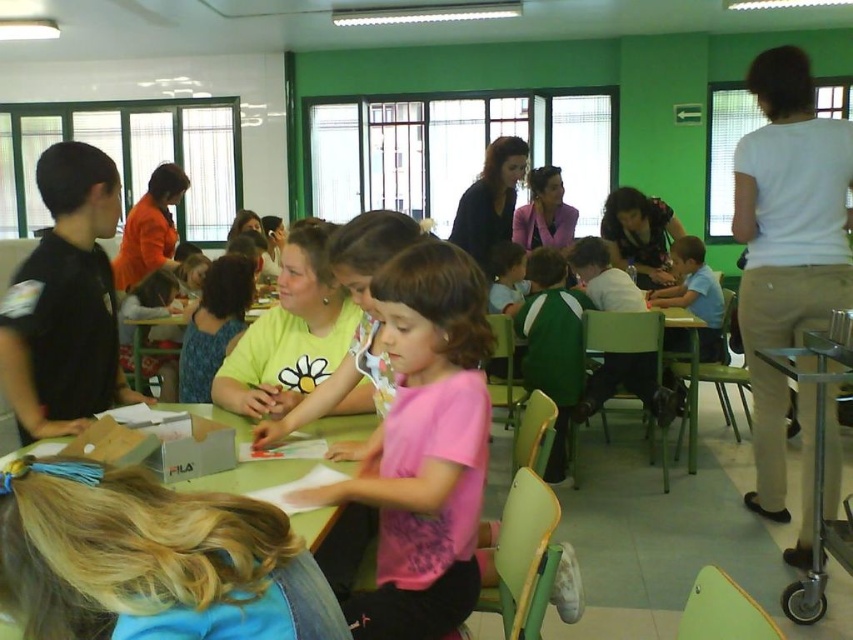
Question: Is pink matte shirt at center thinner than green plastic table at center?

Choices:
 (A) yes
 (B) no

Answer: (A)

Question: Which object is closer to the camera taking this photo?

Choices:
 (A) white cotton shirt at right
 (B) green plastic table at center

Answer: (B)

Question: Estimate the real-world distances between objects in this image. Which object is farther from the green plastic table at center?

Choices:
 (A) white cotton shirt at right
 (B) pink matte shirt at center

Answer: (A)

Question: Which object is positioned farthest from the white cotton shirt at right?

Choices:
 (A) green plastic table at center
 (B) pink matte shirt at center

Answer: (A)

Question: Can you confirm if pink matte shirt at center is thinner than white cotton shirt at right?

Choices:
 (A) no
 (B) yes

Answer: (B)

Question: Does pink matte shirt at center appear under white cotton shirt at right?

Choices:
 (A) yes
 (B) no

Answer: (A)